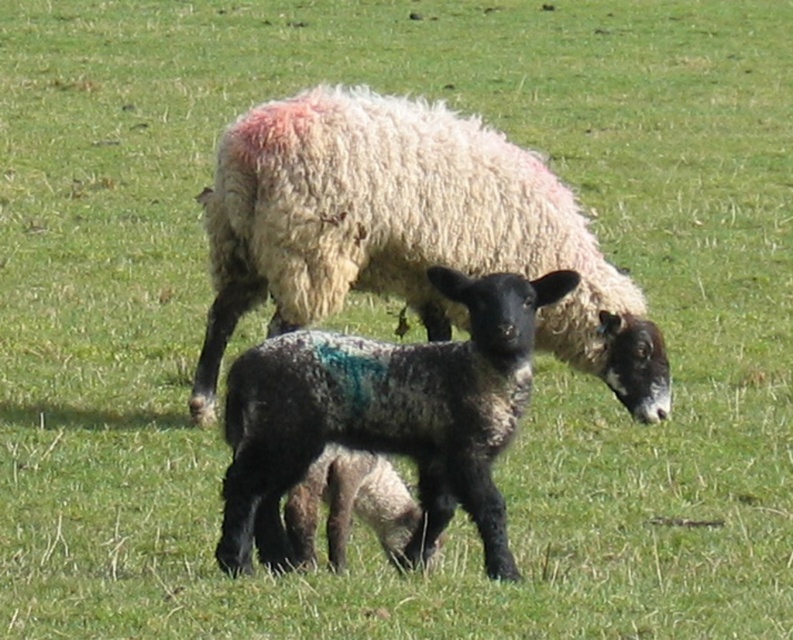
Based on the photo, can you confirm if white woolen sheep at center is thinner than speckled wool lamb at center?

Incorrect, white woolen sheep at center's width is not less than speckled wool lamb at center's.

Is white woolen sheep at center wider than speckled wool lamb at center?

Yes.

The height and width of the screenshot is (640, 793). Describe the element at coordinates (405, 232) in the screenshot. I see `white woolen sheep at center` at that location.

The height and width of the screenshot is (640, 793). I want to click on white woolen sheep at center, so click(x=405, y=232).